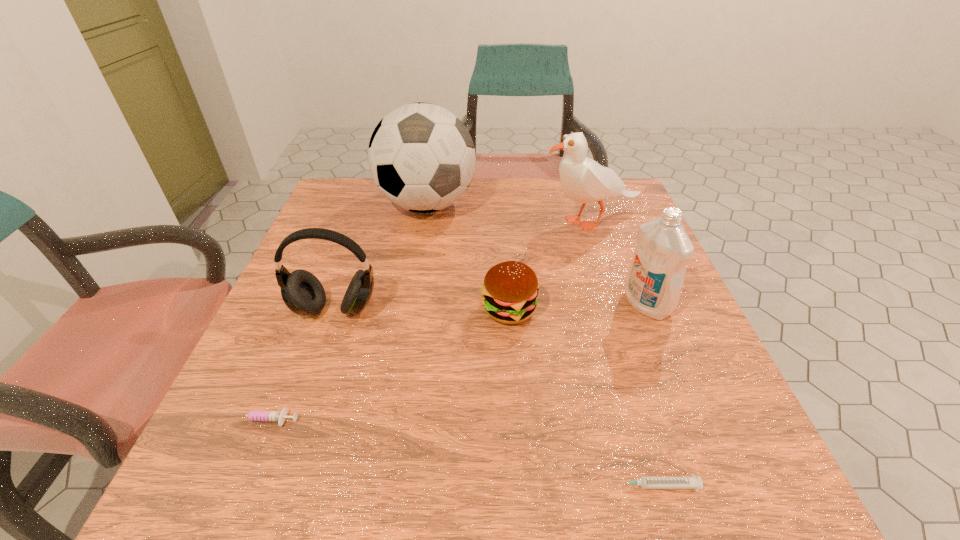
This screenshot has height=540, width=960. Find the location of `soccer ball`. soccer ball is located at coordinates (421, 157).

Locate an element on the screen. gull is located at coordinates (583, 180).

Find the location of a particular element. detergent is located at coordinates (654, 281).

Identify the location of headset. This screenshot has height=540, width=960. (302, 292).

This screenshot has width=960, height=540. Find the location of `the third shortest object`. the third shortest object is located at coordinates (510, 290).

Where is `hamburger`? The height and width of the screenshot is (540, 960). hamburger is located at coordinates (510, 290).

The image size is (960, 540). I want to click on the farther syringe, so click(x=254, y=415).

Image resolution: width=960 pixels, height=540 pixels. What are the coordinates of `the sixth farthest object` in the screenshot? It's located at (254, 415).

Where is `the nearer syringe`? the nearer syringe is located at coordinates (692, 482).

Find the location of a particular element. The width and height of the screenshot is (960, 540). the nearest object is located at coordinates (692, 482).